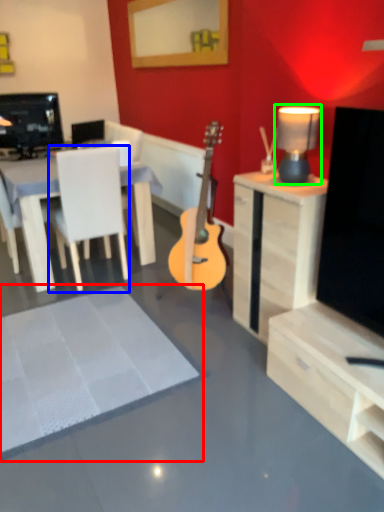
Question: Which is nearer to the flat (highlighted by a red box)? chair (highlighted by a blue box) or lamp (highlighted by a green box).

Choices:
 (A) chair
 (B) lamp

Answer: (A)